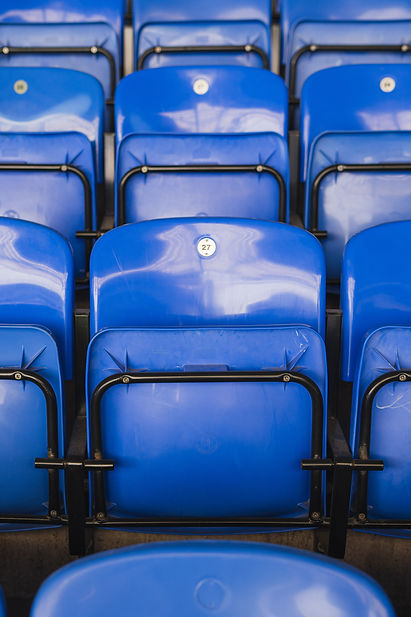
Locate an element on the screen. Image resolution: width=411 pixels, height=617 pixels. back of seat is located at coordinates (62, 6), (196, 7), (333, 4), (350, 93), (232, 106), (70, 102), (36, 296), (214, 296), (371, 279), (277, 571).